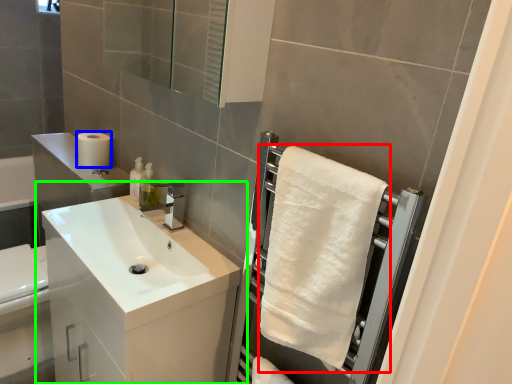
Question: Based on their relative distances, which object is nearer to bath towel (highlighted by a red box)? Choose from toilet paper (highlighted by a blue box) and bathroom cabinet (highlighted by a green box).

Choices:
 (A) toilet paper
 (B) bathroom cabinet

Answer: (B)